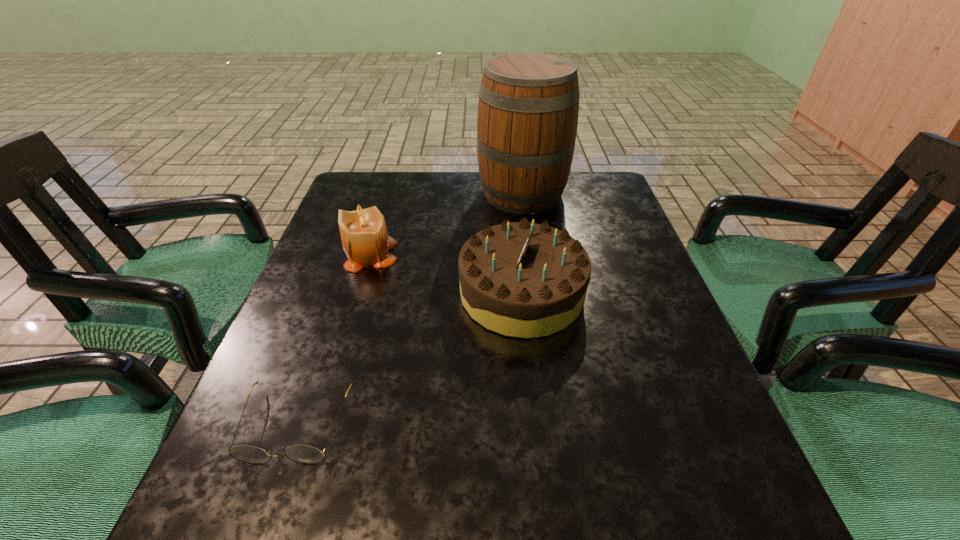
Where is `cider`? This screenshot has height=540, width=960. cider is located at coordinates (528, 106).

Locate an element on the screen. the farthest object is located at coordinates (528, 106).

At what (x,y) coordinates should I click in order to perform the action: click on candle. Please return your answer as a coordinate pair (x, y). This screenshot has height=540, width=960. Looking at the image, I should click on (365, 240).

Identify the location of birthday cake. Image resolution: width=960 pixels, height=540 pixels. click(x=520, y=279).

Identify the location of spectacles. Image resolution: width=960 pixels, height=540 pixels. (303, 453).

This screenshot has width=960, height=540. I want to click on the shortest object, so click(303, 453).

Find the location of a particular element. The width and height of the screenshot is (960, 540). vacant space located on the front of the farthest object is located at coordinates (531, 258).

Identify the location of free location located on the front of the candle. (338, 366).

I want to click on free region located 0.350m on the front-facing side of the birthday cake, so click(x=299, y=293).

I want to click on vacant region located on the front-facing side of the birthday cake, so click(404, 293).